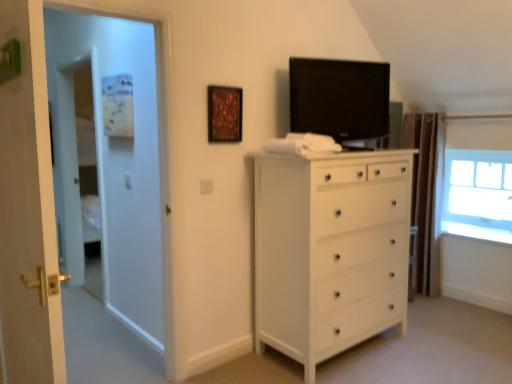
Question: Considering the relative sizes of wooden frame at upper center and black glossy tv at upper center in the image provided, is wooden frame at upper center wider than black glossy tv at upper center?

Choices:
 (A) no
 (B) yes

Answer: (A)

Question: From a real-world perspective, is wooden frame at upper center physically above black glossy tv at upper center?

Choices:
 (A) yes
 (B) no

Answer: (B)

Question: Can you confirm if wooden frame at upper center is positioned to the left of black glossy tv at upper center?

Choices:
 (A) no
 (B) yes

Answer: (B)

Question: Considering the relative sizes of wooden frame at upper center and black glossy tv at upper center in the image provided, is wooden frame at upper center taller than black glossy tv at upper center?

Choices:
 (A) yes
 (B) no

Answer: (B)

Question: Can you see wooden frame at upper center touching black glossy tv at upper center?

Choices:
 (A) yes
 (B) no

Answer: (B)

Question: Is wooden frame at upper center not within black glossy tv at upper center?

Choices:
 (A) yes
 (B) no

Answer: (A)

Question: Is white glossy door at left facing towards wooden frame at upper center?

Choices:
 (A) yes
 (B) no

Answer: (B)

Question: Can you confirm if white glossy door at left is smaller than wooden frame at upper center?

Choices:
 (A) no
 (B) yes

Answer: (A)

Question: Is white glossy door at left positioned before wooden frame at upper center?

Choices:
 (A) no
 (B) yes

Answer: (B)

Question: Are white glossy door at left and wooden frame at upper center located far from each other?

Choices:
 (A) no
 (B) yes

Answer: (A)

Question: Considering the relative positions of white glossy door at left and wooden frame at upper center in the image provided, is white glossy door at left to the right of wooden frame at upper center from the viewer's perspective?

Choices:
 (A) yes
 (B) no

Answer: (B)

Question: From a real-world perspective, is white glossy door at left positioned over wooden frame at upper center based on gravity?

Choices:
 (A) no
 (B) yes

Answer: (A)

Question: From the image's perspective, would you say white wood chest of drawers at center is shown under brown textured curtain at right?

Choices:
 (A) yes
 (B) no

Answer: (A)